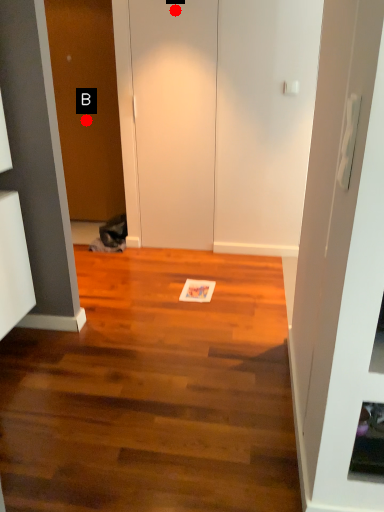
Question: Two points are circled on the image, labeled by A and B beside each circle. Which point is further to the camera?

Choices:
 (A) A is further
 (B) B is further

Answer: (B)